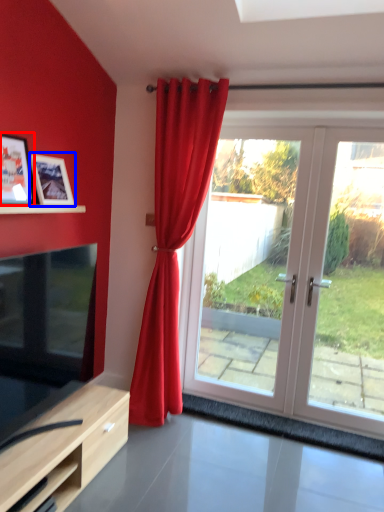
Question: Which point is closer to the camera, picture frame (highlighted by a red box) or picture frame (highlighted by a blue box)?

Choices:
 (A) picture frame
 (B) picture frame

Answer: (A)